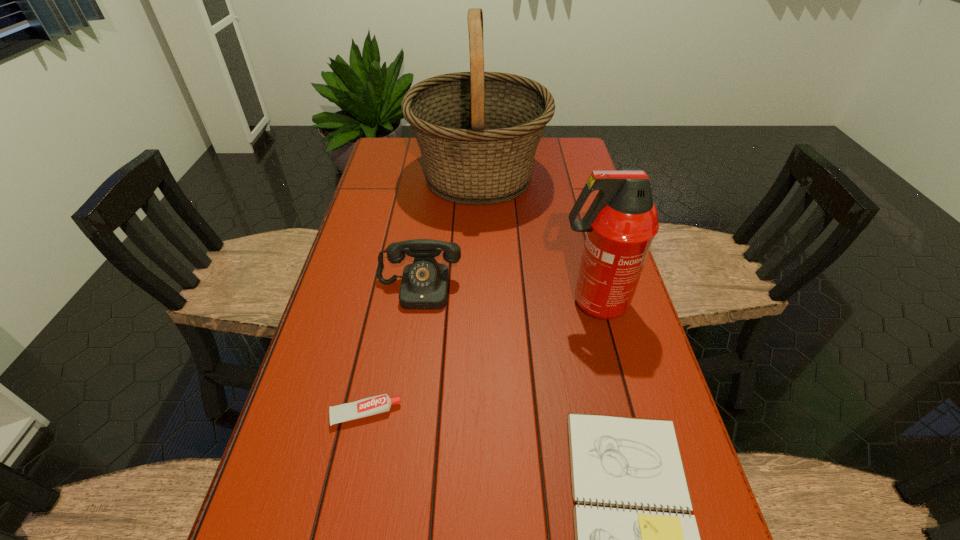
Locate an element on the screen. vacant space located 0.060m on the right of the second shortest object is located at coordinates (430, 414).

Identify the location of object at the far edge. (478, 132).

Locate an element on the screen. This screenshot has width=960, height=540. basket present at the left edge is located at coordinates (478, 132).

You are a GUI agent. You are given a task and a screenshot of the screen. Output one action in this format:
    pyautogui.click(x=<x>, y=<y>)
    Task: Click on the telephone at the left edge
    The height and width of the screenshot is (540, 960).
    Given the screenshot: What is the action you would take?
    pyautogui.click(x=424, y=285)

Find the location of a particular element. toothpaste present at the left edge is located at coordinates (374, 405).

Image resolution: width=960 pixels, height=540 pixels. I want to click on basket that is positioned at the right edge, so click(478, 132).

At what (x,y) coordinates should I click in order to perform the action: click on fire extinguisher present at the right edge. Please return your answer as a coordinate pair (x, y). This screenshot has width=960, height=540. Looking at the image, I should click on (621, 222).

The image size is (960, 540). I want to click on object present at the far left corner, so click(x=478, y=132).

The width and height of the screenshot is (960, 540). I want to click on object located at the far right corner, so click(478, 132).

The width and height of the screenshot is (960, 540). In the image, there is a desktop. What are the coordinates of `free space at the left edge` in the screenshot? It's located at (370, 200).